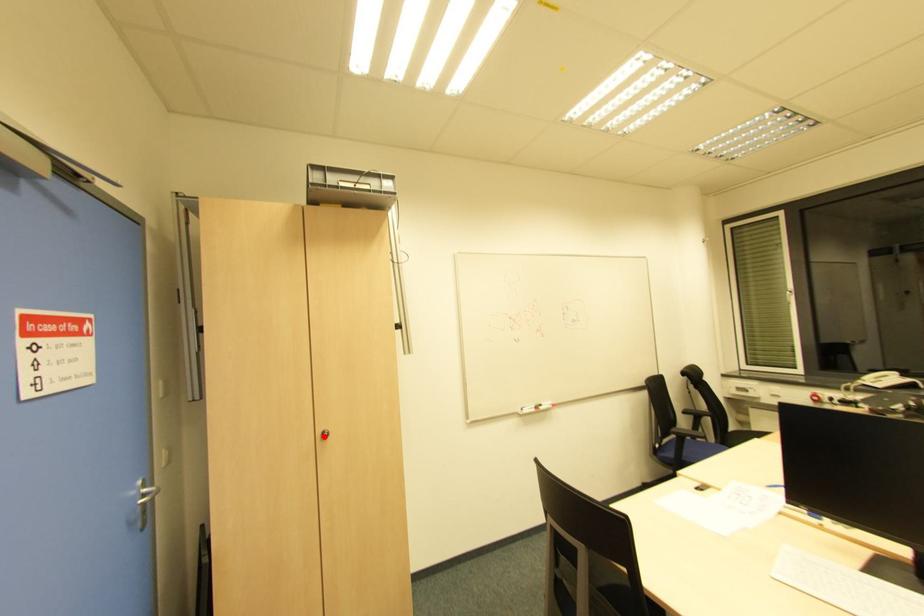
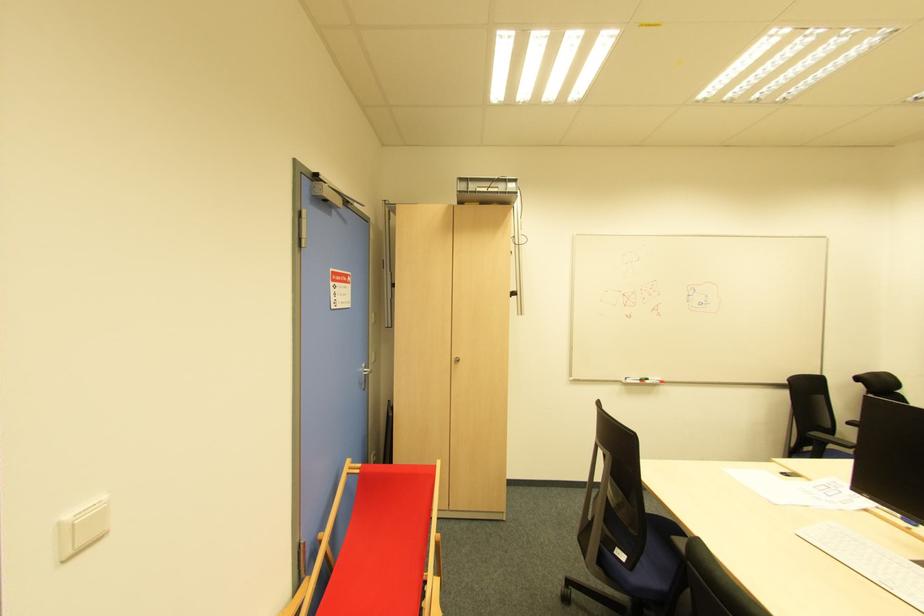
The point at the highlighted location is marked in the first image. Where is the corresponding point in the second image?

(457, 362)